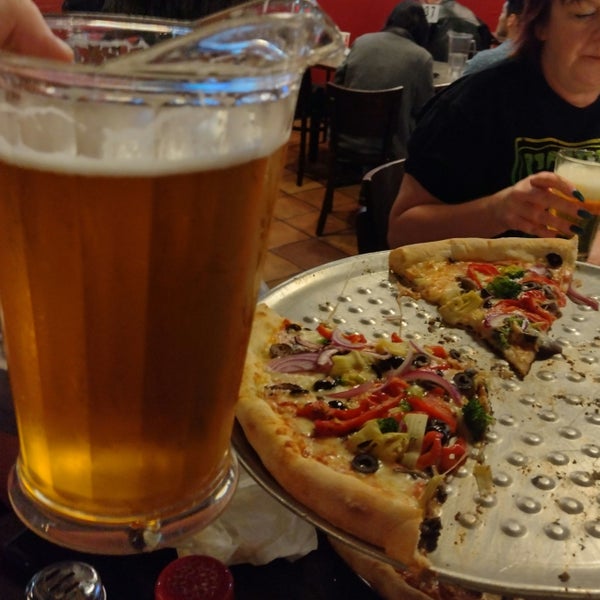
Image resolution: width=600 pixels, height=600 pixels. What are the coordinates of `serving platter` in the screenshot? It's located at (536, 440).